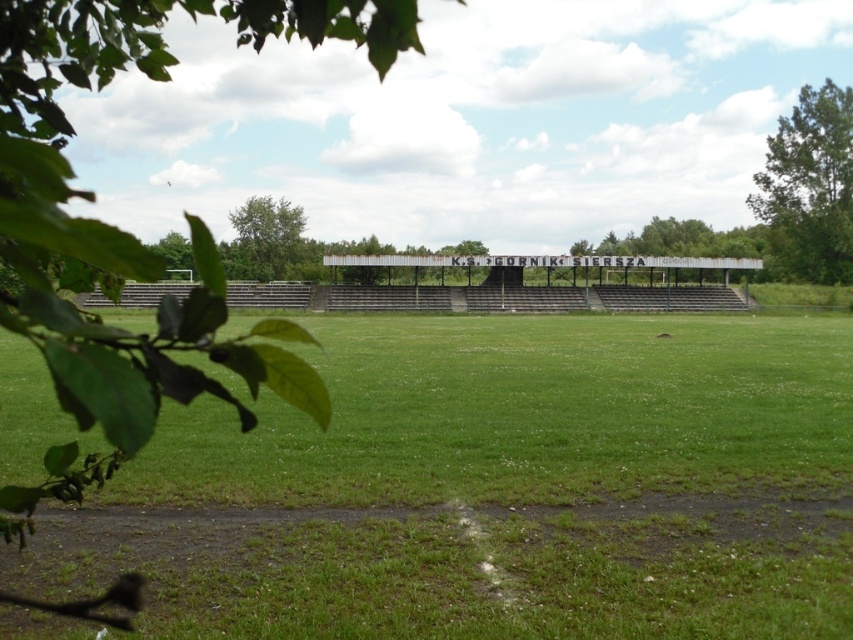
Question: Among these points, which one is farthest from the camera?

Choices:
 (A) (276, 227)
 (B) (640, 240)
 (C) (804, 230)

Answer: (B)

Question: Which object is the closest to the green grass field at center?

Choices:
 (A) green leafy tree at upper right
 (B) rusty metal sign at center

Answer: (A)

Question: Can you confirm if green leafy tree at upper right is positioned to the left of green leafy tree at upper left?

Choices:
 (A) yes
 (B) no

Answer: (B)

Question: Does green grass field at center have a lesser width compared to green leafy tree at upper right?

Choices:
 (A) yes
 (B) no

Answer: (B)

Question: Can you confirm if green grass field at center is wider than green leafy tree at upper left?

Choices:
 (A) yes
 (B) no

Answer: (A)

Question: Among these objects, which one is nearest to the camera?

Choices:
 (A) rusty metal sign at center
 (B) green grass field at center
 (C) green leafy tree at upper left

Answer: (B)